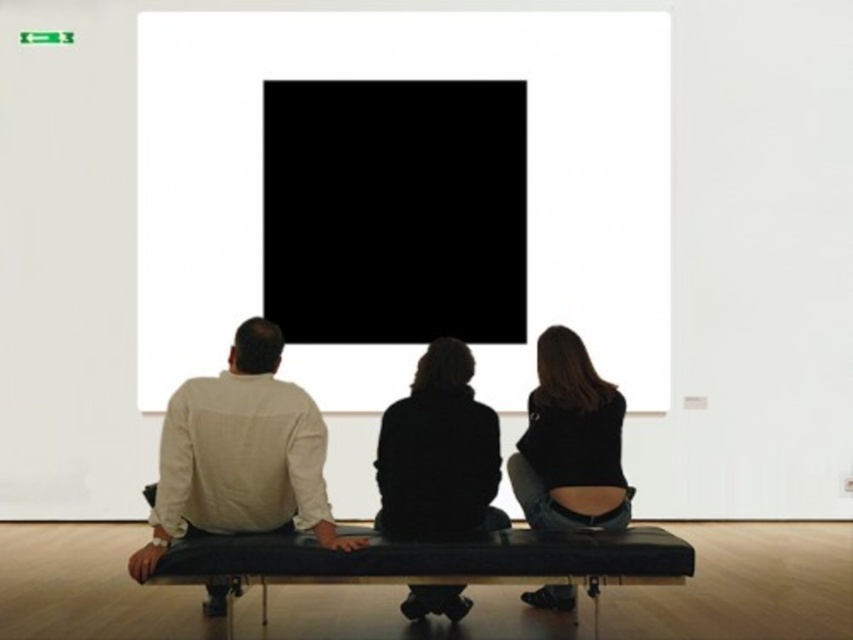
Question: Is matte black bench at center above black leather bench at center?

Choices:
 (A) yes
 (B) no

Answer: (A)

Question: Which object appears farthest from the camera in this image?

Choices:
 (A) black leather jacket at center
 (B) white matte shirt at center

Answer: (A)

Question: Is white matte shirt at center further to camera compared to silhouette fabric jacket at center?

Choices:
 (A) no
 (B) yes

Answer: (A)

Question: Which point is farther to the camera?

Choices:
 (A) (566, 500)
 (B) (389, 468)

Answer: (A)

Question: Which of the following is the closest to the observer?

Choices:
 (A) (149, 492)
 (B) (618, 454)
 (C) (605, 417)
 (D) (436, 344)

Answer: (D)

Question: Considering the relative positions of black leather bench at center and silhouette fabric jacket at center in the image provided, where is black leather bench at center located with respect to silhouette fabric jacket at center?

Choices:
 (A) below
 (B) above

Answer: (A)